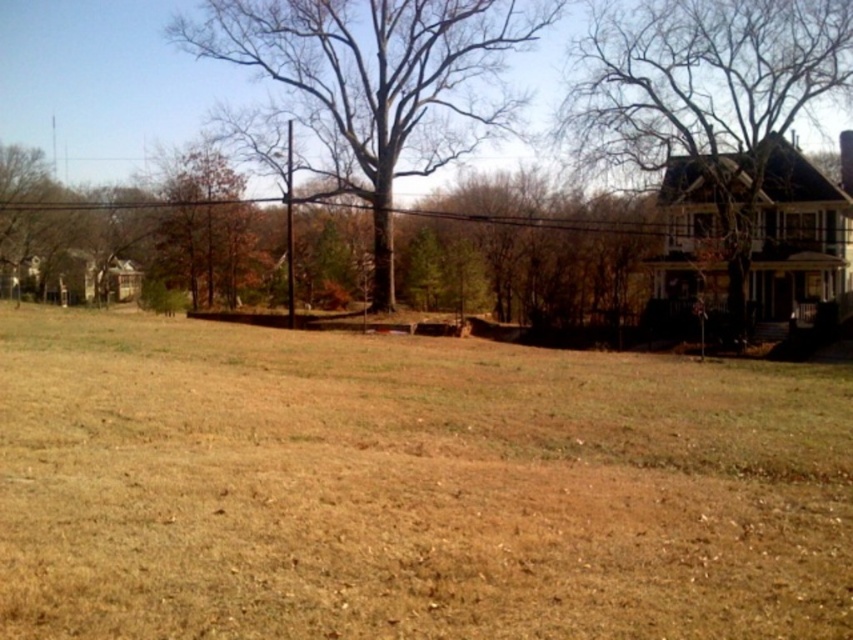
You are a painter standing at the base of the large central tree. You want to paint a landscape that includes both the brown wooden fence at upper center and the bare branches at upper right. Your easel is 1.5 meters wide. Can you position your easel between these two objects without blocking either of them?

The distance between the brown wooden fence at upper center and the bare branches at upper right is 7.50 meters. Since your easel is only 1.5 meters wide, there is sufficient space to position it between them without blocking either object.

You are a gardener looking at the brown wooden fence at upper center and the bare branches at upper right. Which object is located to the left of the other?

The brown wooden fence at upper center is positioned on the left side of bare branches at upper right.